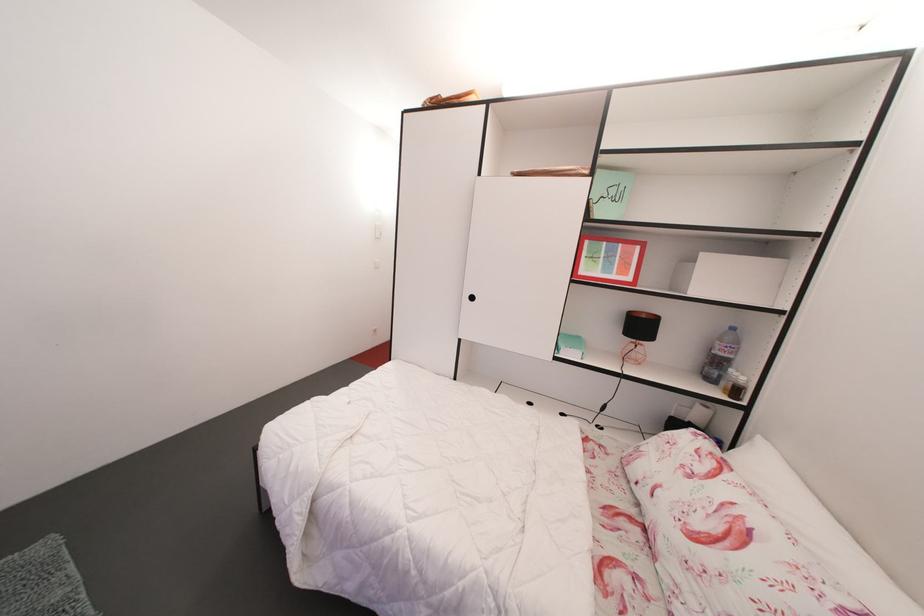
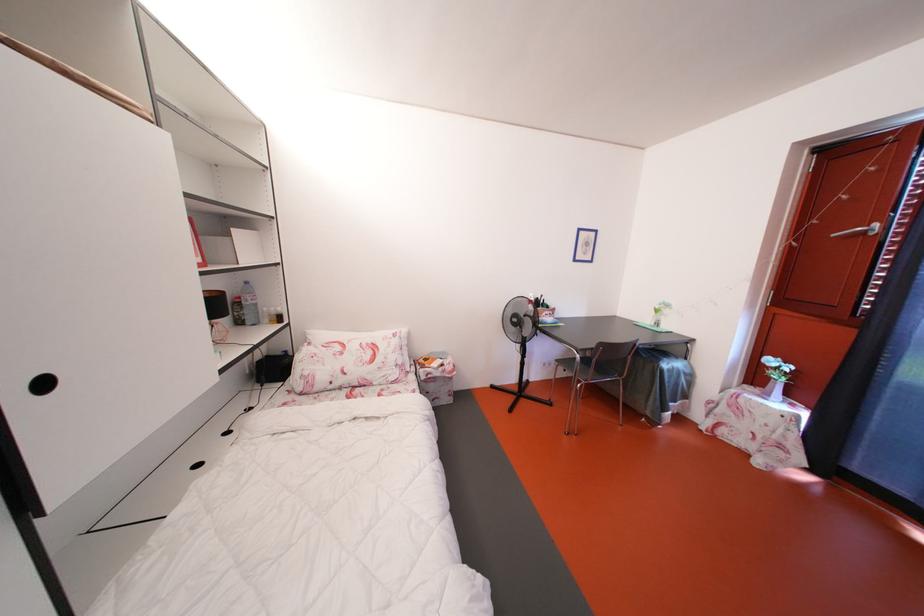
Find the pixel in the second image that matches point 739,334 in the first image.

(253, 288)